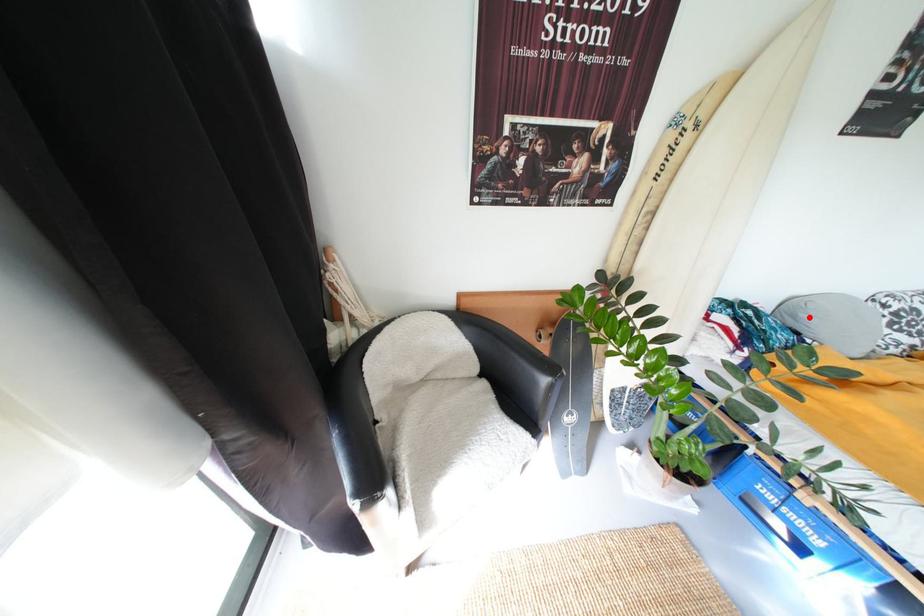
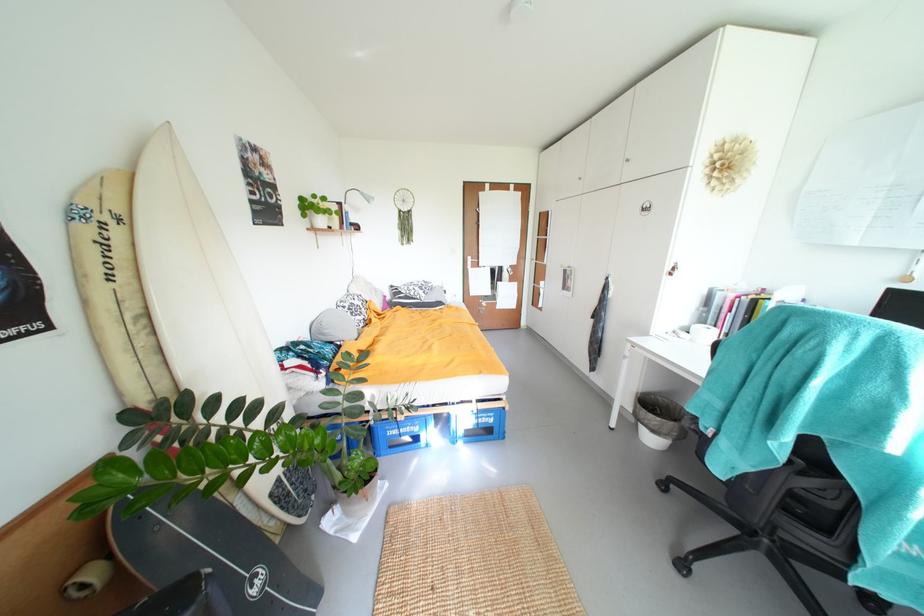
The point at the highlighted location is marked in the first image. Where is the corresponding point in the second image?

(333, 333)